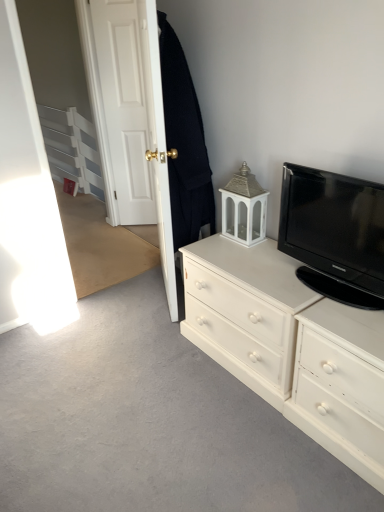
In order to click on free location in front of white painted wood chest of drawers at right in this screenshot , I will do `click(238, 442)`.